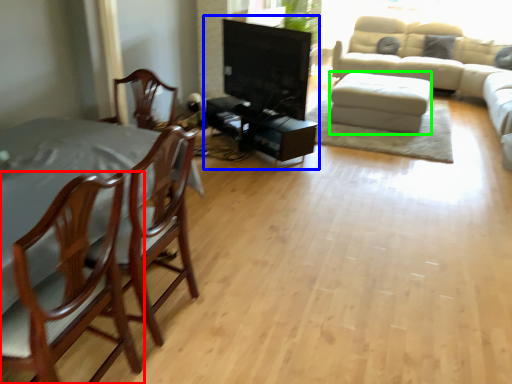
Question: Considering the real-world distances, which object is farthest from chair (highlighted by a red box)? entertainment center (highlighted by a blue box) or footrest (highlighted by a green box)?

Choices:
 (A) entertainment center
 (B) footrest

Answer: (B)